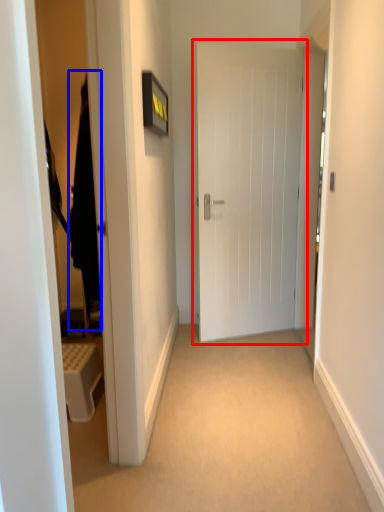
Question: Which of the following is the farthest to the observer, door (highlighted by a red box) or robe (highlighted by a blue box)?

Choices:
 (A) door
 (B) robe

Answer: (A)